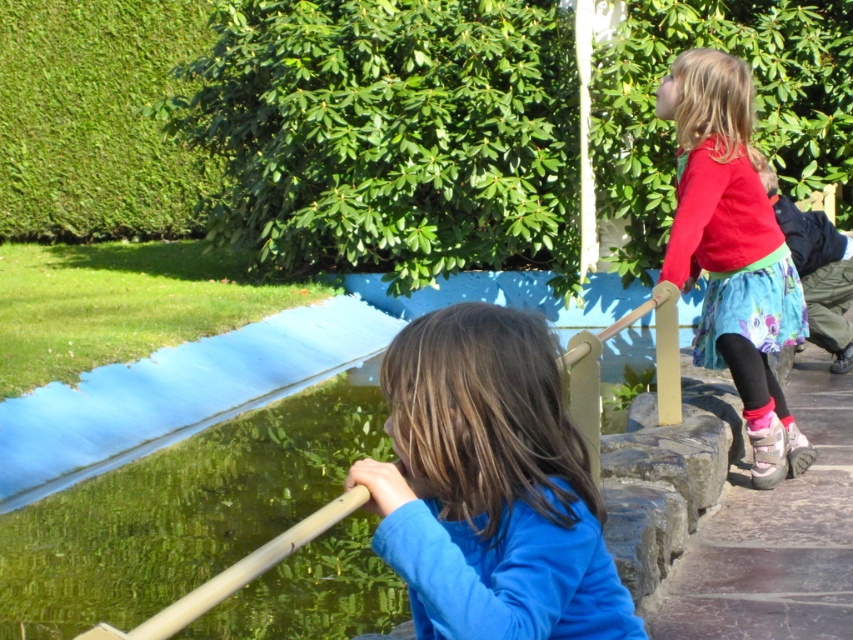
Is blue matte shirt at center bigger than red cotton shirt at upper right?

Actually, blue matte shirt at center might be smaller than red cotton shirt at upper right.

The height and width of the screenshot is (640, 853). Describe the element at coordinates (489, 484) in the screenshot. I see `blue matte shirt at center` at that location.

Is point (451, 339) farther from viewer compared to point (779, 476)?

No, it is not.

The height and width of the screenshot is (640, 853). I want to click on blue matte shirt at center, so click(x=489, y=484).

Between green translucent water at center and floral skirt at upper right, which one appears on the left side from the viewer's perspective?

green translucent water at center

Does green translucent water at center come behind floral skirt at upper right?

No, green translucent water at center is closer to the viewer.

Consider the image. Measure the distance between point (222, 589) and camera.

The distance of point (222, 589) from camera is 6.42 feet.

Find the location of `green translucent water at center`. green translucent water at center is located at coordinates (x=247, y=570).

Between point (415, 580) and point (229, 593), which one is positioned in front?

Positioned in front is point (415, 580).

Measure the distance between blue matte shirt at center and green translucent water at center.

They are 2.37 meters apart.

Which is behind, point (628, 605) or point (187, 432)?

Point (187, 432)

At what (x,y) coordinates should I click in order to perform the action: click on blue matte shirt at center. Please return your answer as a coordinate pair (x, y). This screenshot has height=640, width=853. Looking at the image, I should click on (489, 484).